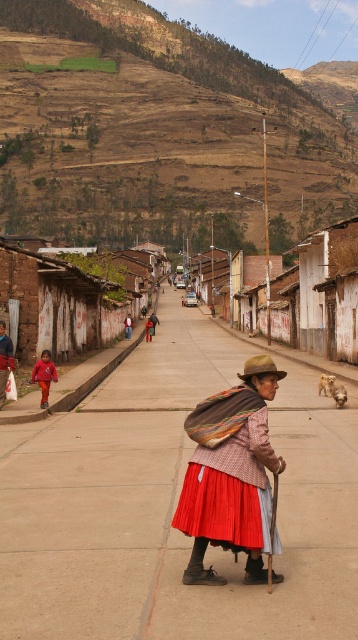
Does matte red sweater at left appear under red fabric skirt at lower left?

Correct, matte red sweater at left is located below red fabric skirt at lower left.

Identify the location of matte red sweater at left. Image resolution: width=358 pixels, height=640 pixels. (44, 376).

Locate an element on the screen. This screenshot has height=640, width=358. matte red sweater at left is located at coordinates (44, 376).

Is red plaid shawl at center bigger than red fabric shawl at center?

Actually, red plaid shawl at center might be smaller than red fabric shawl at center.

Does red plaid shawl at center appear under red fabric shawl at center?

Yes, red plaid shawl at center is below red fabric shawl at center.

Locate an element on the screen. The height and width of the screenshot is (640, 358). red plaid shawl at center is located at coordinates (230, 474).

At what (x,y) coordinates should I click in order to perform the action: click on red plaid shawl at center. Please return your answer as a coordinate pair (x, y). The height and width of the screenshot is (640, 358). Looking at the image, I should click on (230, 474).

Between point (352, 570) and point (126, 323), which one is positioned in front?

Point (352, 570) is in front.

Does smooth concrete pavement at center have a smaller size compared to red fabric jacket at center?

Actually, smooth concrete pavement at center might be larger than red fabric jacket at center.

What do you see at coordinates (171, 504) in the screenshot?
I see `smooth concrete pavement at center` at bounding box center [171, 504].

Identify the location of smooth concrete pavement at center. (171, 504).